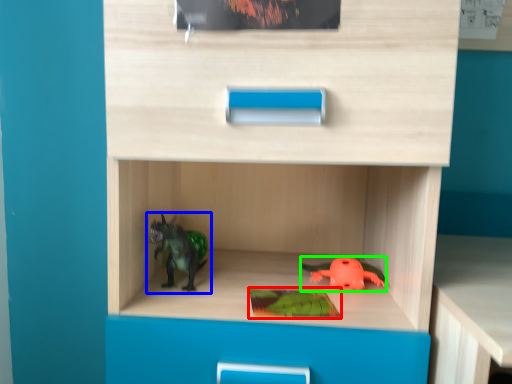
Question: Which object is positioned closest to paperback book (highlighted by a red box)? Select from toy (highlighted by a blue box) and toy (highlighted by a green box).

Choices:
 (A) toy
 (B) toy

Answer: (B)